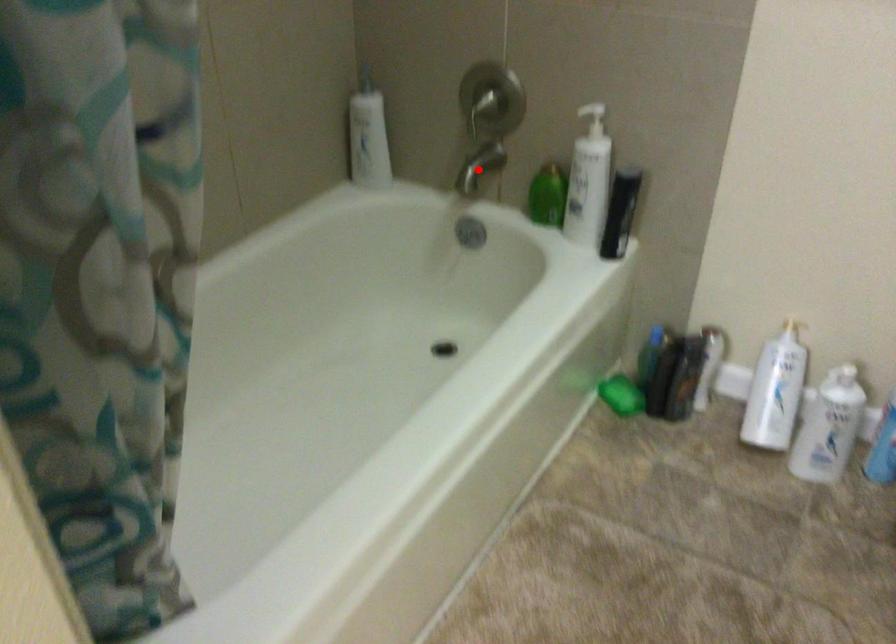
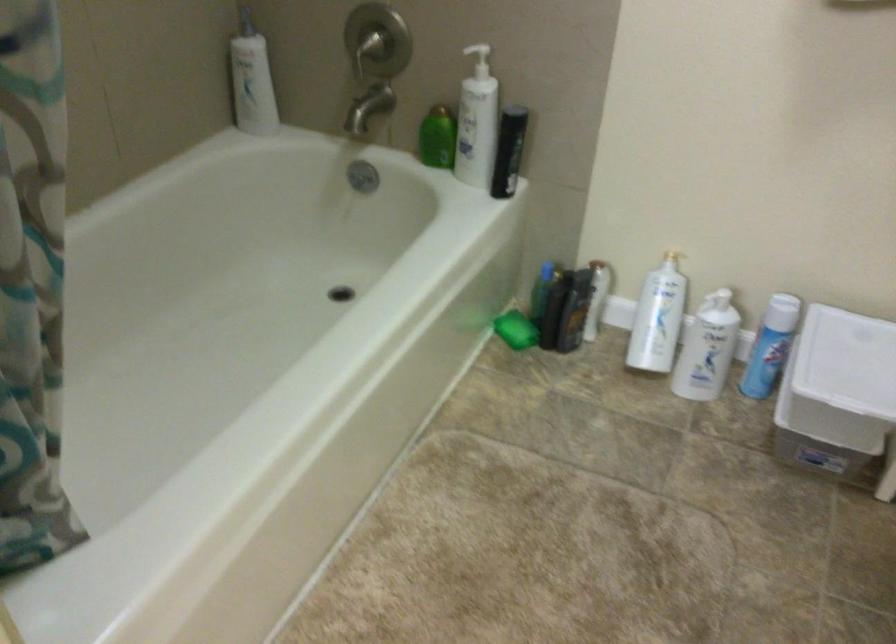
Find the pixel in the second image that matches the highlighted location in the first image.

(368, 108)